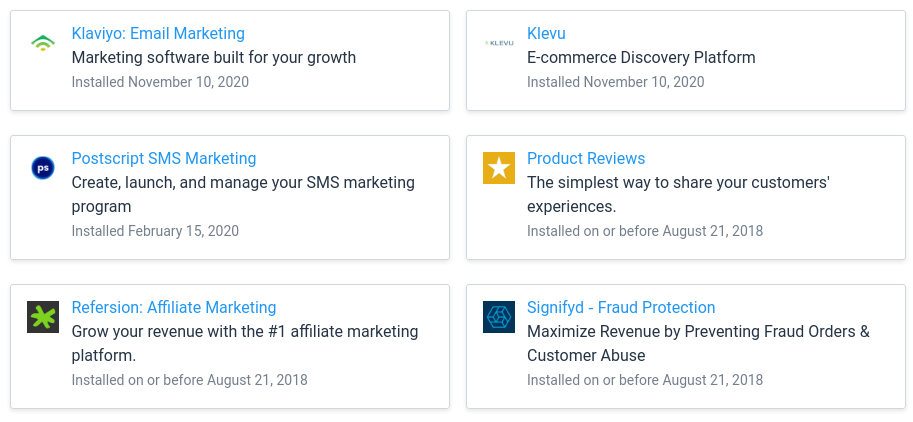
What are the coordinates of `box` in the screenshot? It's located at (496, 398).